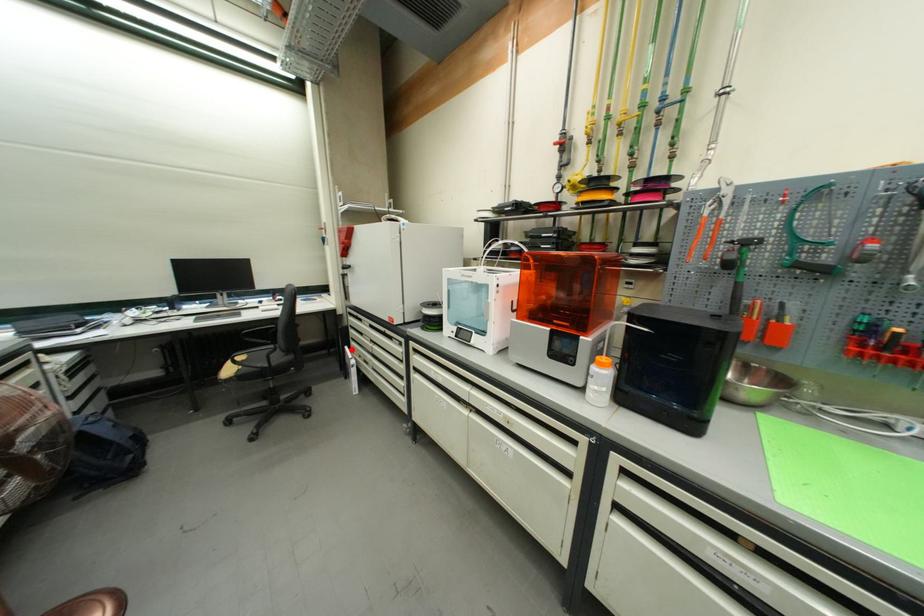
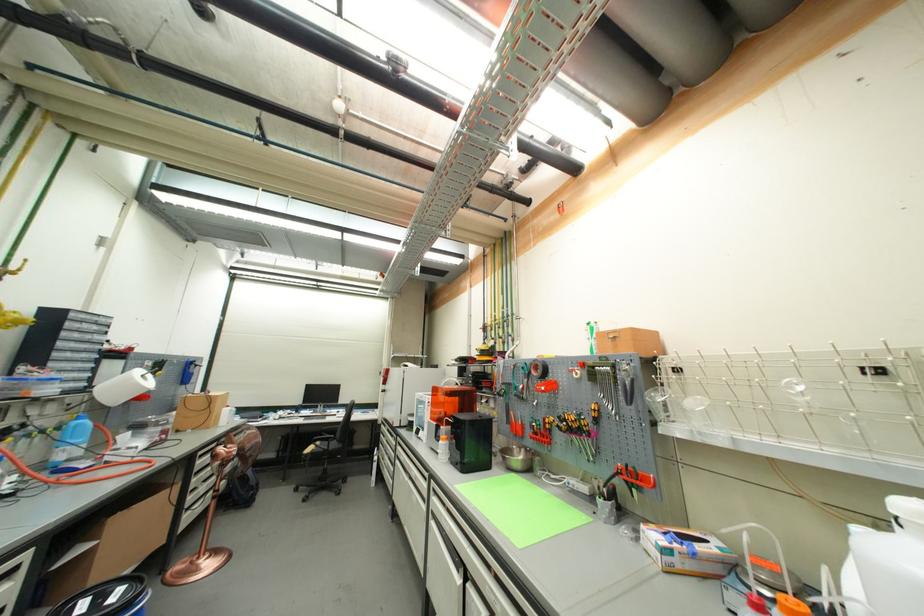
Question: A red point is marked in image1. In image2, is the corresponding 3D point closer to the camera or farther? Reply with the corresponding letter.

Choices:
 (A) The corresponding 3D point is closer.
 (B) The corresponding 3D point is farther.

Answer: (B)